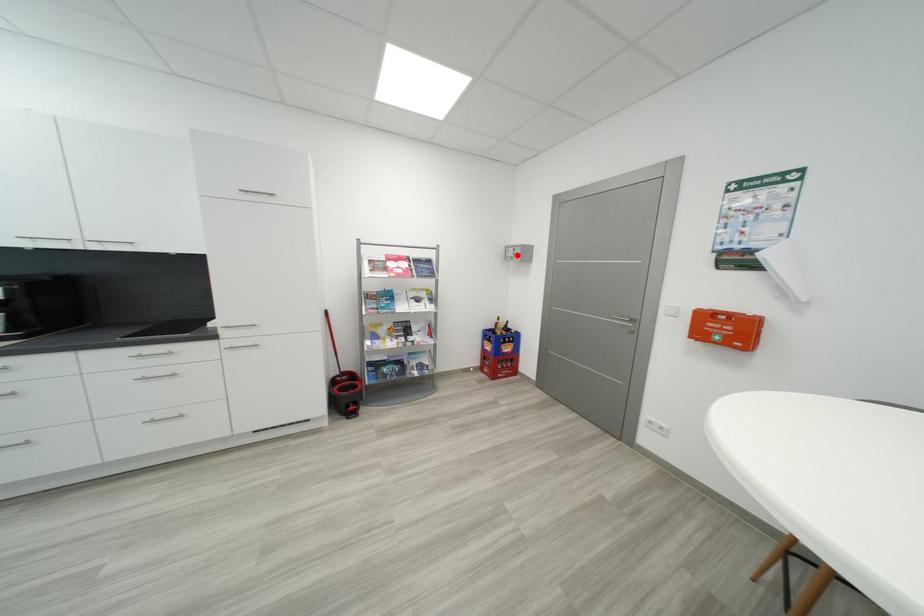
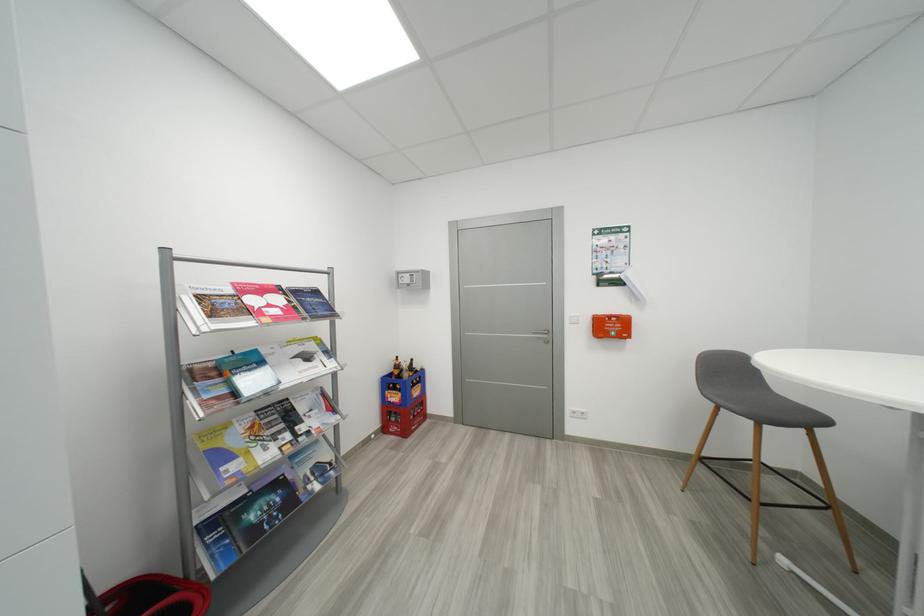
In the second image, find the point that corresponds to the highlighted location in the first image.

(412, 282)